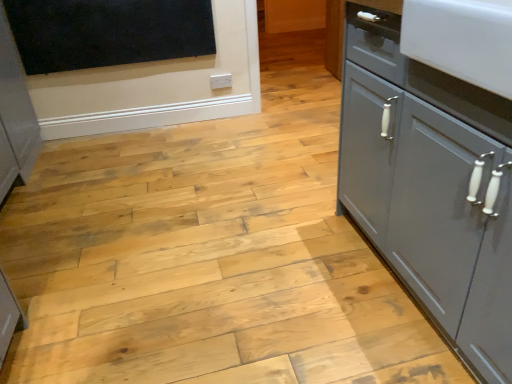
Question: Can you confirm if black matte board at upper left is smaller than matte gray cabinet at right?

Choices:
 (A) no
 (B) yes

Answer: (B)

Question: Is black matte board at upper left bigger than matte gray cabinet at right?

Choices:
 (A) yes
 (B) no

Answer: (B)

Question: From the image's perspective, does black matte board at upper left appear higher than matte gray cabinet at right?

Choices:
 (A) yes
 (B) no

Answer: (A)

Question: Can you confirm if black matte board at upper left is taller than matte gray cabinet at right?

Choices:
 (A) yes
 (B) no

Answer: (B)

Question: Does black matte board at upper left have a greater width compared to matte gray cabinet at right?

Choices:
 (A) yes
 (B) no

Answer: (B)

Question: From a real-world perspective, does black matte board at upper left sit lower than matte gray cabinet at right?

Choices:
 (A) yes
 (B) no

Answer: (B)

Question: Is matte gray cabinet at right directly adjacent to black matte board at upper left?

Choices:
 (A) no
 (B) yes

Answer: (A)

Question: From the image's perspective, is matte gray cabinet at right under black matte board at upper left?

Choices:
 (A) no
 (B) yes

Answer: (B)

Question: Does matte gray cabinet at right have a greater width compared to black matte board at upper left?

Choices:
 (A) no
 (B) yes

Answer: (B)

Question: From a real-world perspective, is matte gray cabinet at right on top of black matte board at upper left?

Choices:
 (A) no
 (B) yes

Answer: (A)

Question: Is black matte board at upper left completely or partially inside matte gray cabinet at right?

Choices:
 (A) no
 (B) yes

Answer: (A)

Question: Can you confirm if matte gray cabinet at right is thinner than black matte board at upper left?

Choices:
 (A) yes
 (B) no

Answer: (B)

Question: Is black matte board at upper left taller or shorter than matte gray cabinet at right?

Choices:
 (A) tall
 (B) short

Answer: (B)